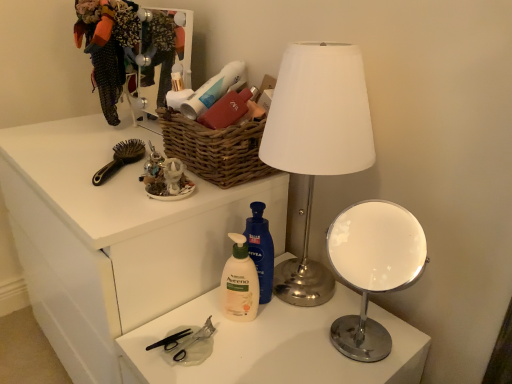
This screenshot has width=512, height=384. What are the coordinates of `free location in front of metallic silver lamp at center` in the screenshot? It's located at (284, 356).